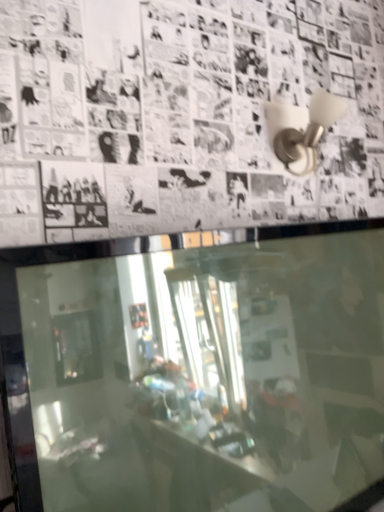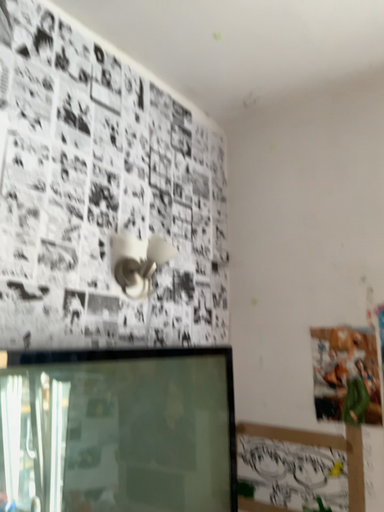
Question: How did the camera likely rotate when shooting the video?

Choices:
 (A) rotated downward
 (B) rotated upward

Answer: (B)